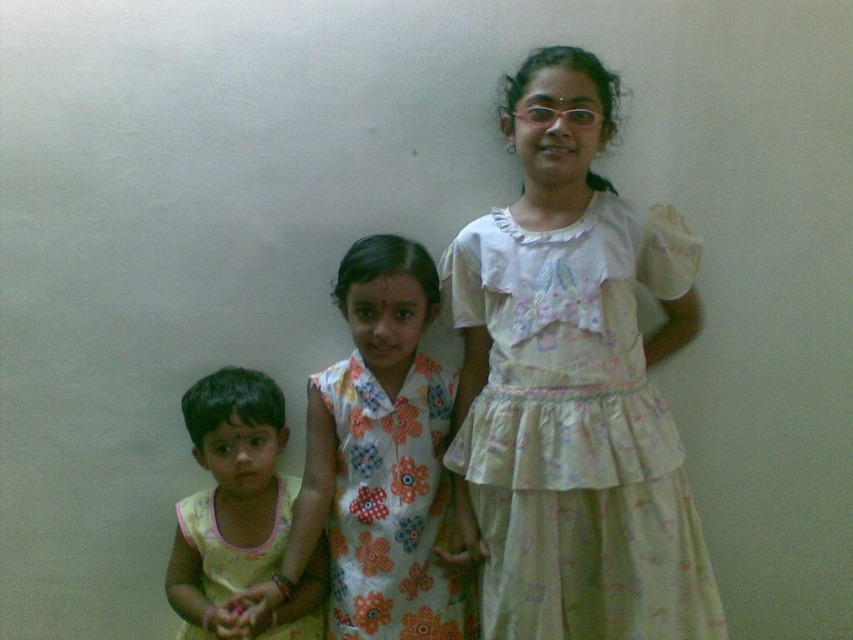
You are a photographer setting up for a group photo. You notice the white satin dress at upper right and the yellow cotton dress at lower left in the scene. Based on their positions, which dress is higher in the image?

The white satin dress at upper right is higher in the image than the yellow cotton dress at lower left because it is positioned above it.